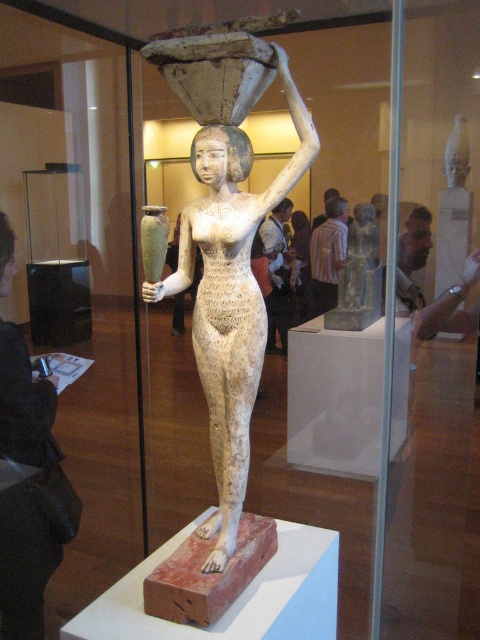
Does white stone statue at center have a lesser width compared to black leather jacket at lower left?

In fact, white stone statue at center might be wider than black leather jacket at lower left.

Is white stone statue at center closer to the viewer compared to black leather jacket at lower left?

Yes, white stone statue at center is closer to the viewer.

Is point (226, 522) closer to viewer compared to point (38, 556)?

Yes.

At what (x,y) coordinates should I click in order to perform the action: click on white stone statue at center. Please return your answer as a coordinate pair (x, y). Looking at the image, I should click on (227, 243).

Can you confirm if white stone statue at center is thinner than white stone vase at upper right?

No, white stone statue at center is not thinner than white stone vase at upper right.

Who is taller, white stone statue at center or white stone vase at upper right?

white stone statue at center is taller.

Describe the element at coordinates (227, 243) in the screenshot. I see `white stone statue at center` at that location.

Where is `white stone statue at center`? This screenshot has width=480, height=640. white stone statue at center is located at coordinates (227, 243).

Is point (208, 339) positioned behind point (370, 204)?

No, (208, 339) is in front of (370, 204).

In the scene shown: Can you confirm if white stone statue at center is positioned below gray stone statue at center?

Yes, white stone statue at center is below gray stone statue at center.

Who is more distant from viewer, (206, 564) or (369, 209)?

The point (369, 209) is more distant.

The image size is (480, 640). Identify the location of white stone statue at center. (227, 243).